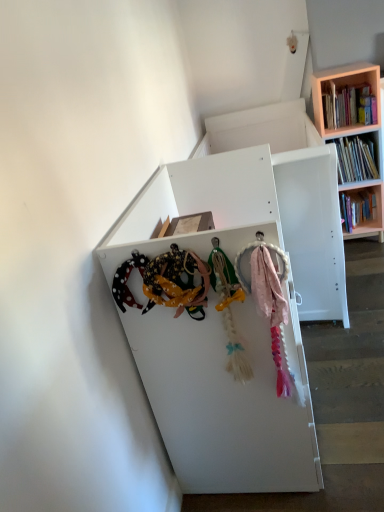
Question: From a real-world perspective, is white matte shelf at center positioned above or below wooden bookshelf at upper right?

Choices:
 (A) below
 (B) above

Answer: (A)

Question: Considering the positions of white matte shelf at center and wooden bookshelf at upper right in the image, is white matte shelf at center wider or thinner than wooden bookshelf at upper right?

Choices:
 (A) wide
 (B) thin

Answer: (A)

Question: Which of these objects is positioned closest to the wooden bookshelf at upper right?

Choices:
 (A) wooden bookshelf at upper right
 (B) white matte shelf at center

Answer: (A)

Question: Which object is positioned farthest from the wooden bookshelf at upper right?

Choices:
 (A) wooden bookshelf at upper right
 (B) white matte shelf at center

Answer: (B)